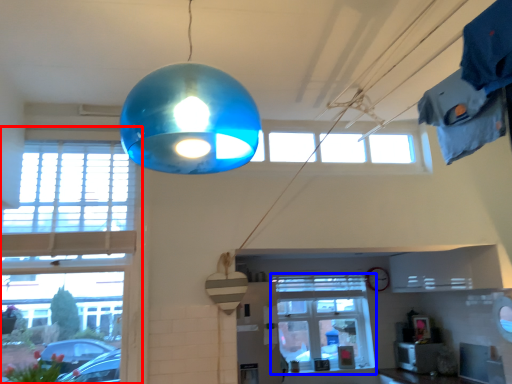
Question: Which point is further to the camera, window (highlighted by a red box) or window (highlighted by a blue box)?

Choices:
 (A) window
 (B) window

Answer: (B)